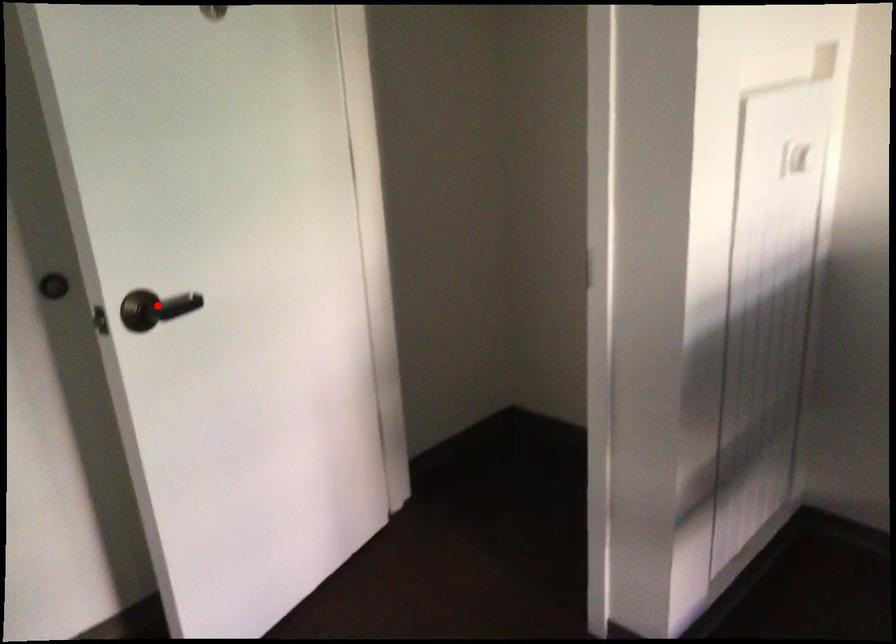
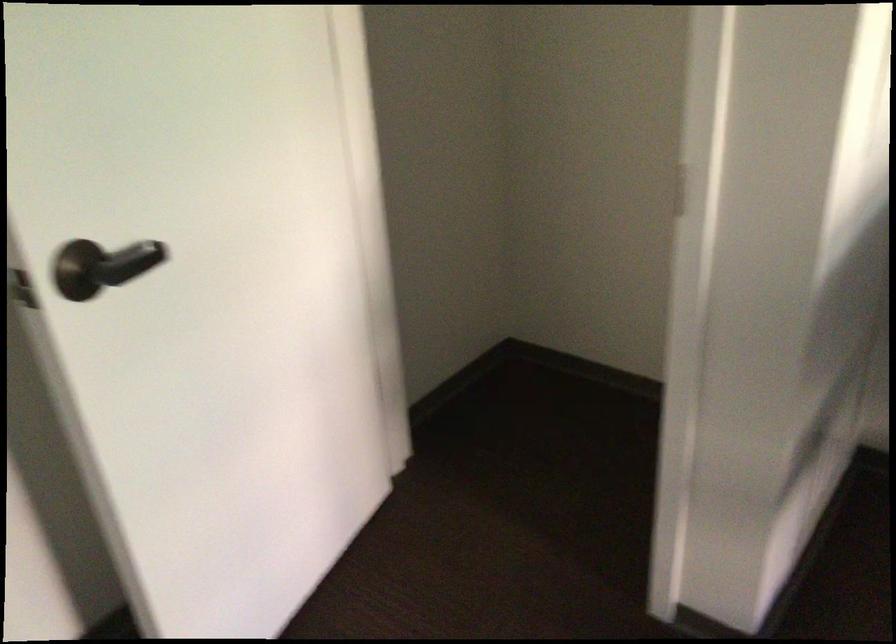
Locate, in the second image, the point that corresponds to the highlighted location in the first image.

(107, 265)